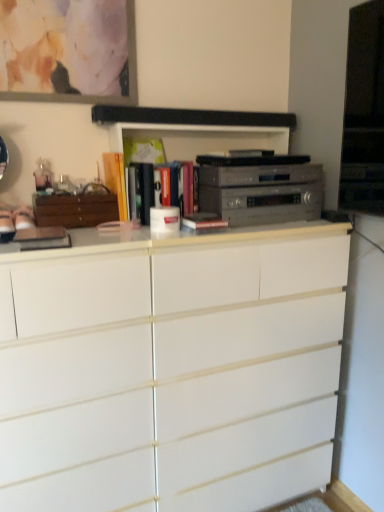
What are the coordinates of `free space in front of wooden cabinet at left` in the screenshot? It's located at (72, 234).